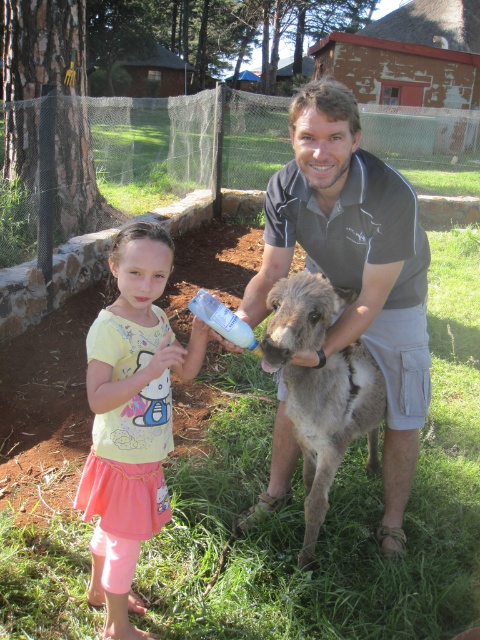
Is yellow cotton shirt at left to the left of fuzzy gray donkey at center from the viewer's perspective?

Indeed, yellow cotton shirt at left is positioned on the left side of fuzzy gray donkey at center.

Based on the photo, can you confirm if yellow cotton shirt at left is shorter than fuzzy gray donkey at center?

No.

Where is `yellow cotton shirt at left`? This screenshot has height=640, width=480. yellow cotton shirt at left is located at coordinates (131, 419).

Is fuzzy gray donkey at center taller than white plastic bottle at center?

Yes.

Which is more to the right, fuzzy gray donkey at center or white plastic bottle at center?

fuzzy gray donkey at center is more to the right.

Does point (299, 308) lie in front of point (226, 317)?

That is True.

At what (x,y) coordinates should I click in order to perform the action: click on fuzzy gray donkey at center. Please return your answer as a coordinate pair (x, y). Image resolution: width=480 pixels, height=640 pixels. Looking at the image, I should click on (322, 388).

Which is behind, point (387, 289) or point (217, 307)?

Point (387, 289)

The width and height of the screenshot is (480, 640). Identify the location of dark gray shirt at center. (355, 268).